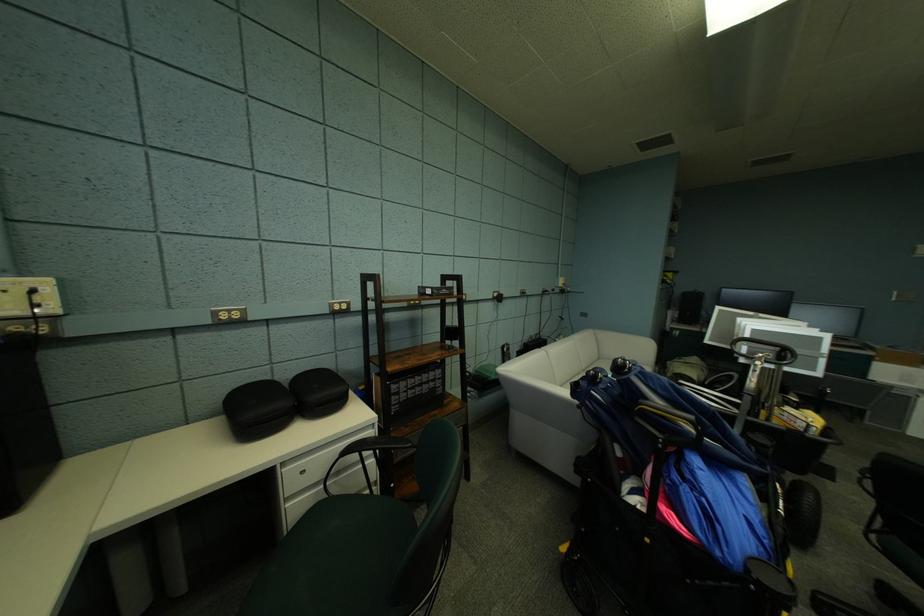
Where would you resting arm the white sofa armrest? Please return your answer as a coordinate pair (x, y).

(533, 389)